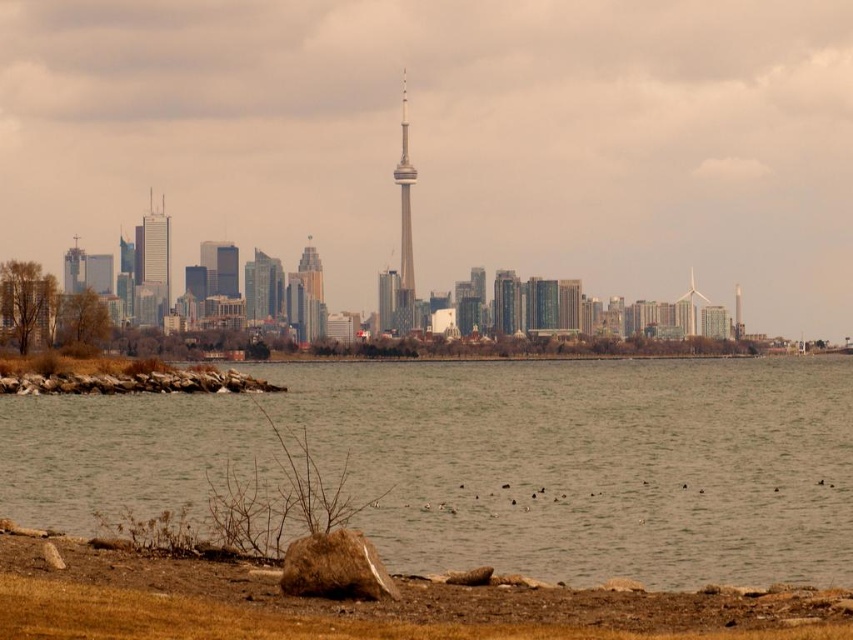
Question: Which point is farther to the camera?

Choices:
 (A) (323, 330)
 (B) (115, 637)
 (C) (148, 218)

Answer: (C)

Question: Which of the following is the farthest from the observer?

Choices:
 (A) (67, 288)
 (B) (302, 312)

Answer: (A)

Question: Where is smooth beige tower at center located in relation to smooth glass skyscraper at center in the image?

Choices:
 (A) above
 (B) below

Answer: (A)

Question: Observing the image, what is the correct spatial positioning of gold reflective glass skyscraper at center in reference to matte glass skyscraper at left?

Choices:
 (A) above
 (B) below

Answer: (A)

Question: Which of the following is the closest to the observer?

Choices:
 (A) (407, 237)
 (B) (45, 624)
 (C) (740, 317)
 (D) (787, 442)

Answer: (B)

Question: Does brown water at lower center have a greater width compared to smooth glass skyscraper at center?

Choices:
 (A) yes
 (B) no

Answer: (A)